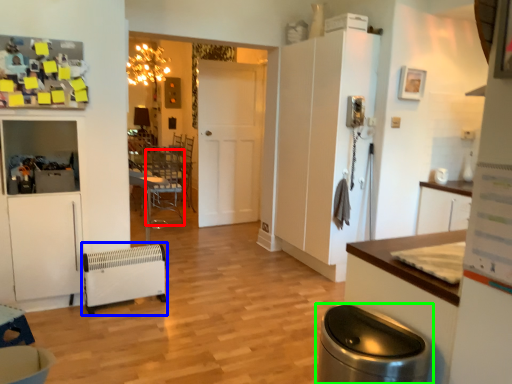
Question: Which is nearer to the armchair (highlighted by a red box)? appliance (highlighted by a blue box) or waste container (highlighted by a green box).

Choices:
 (A) appliance
 (B) waste container

Answer: (A)